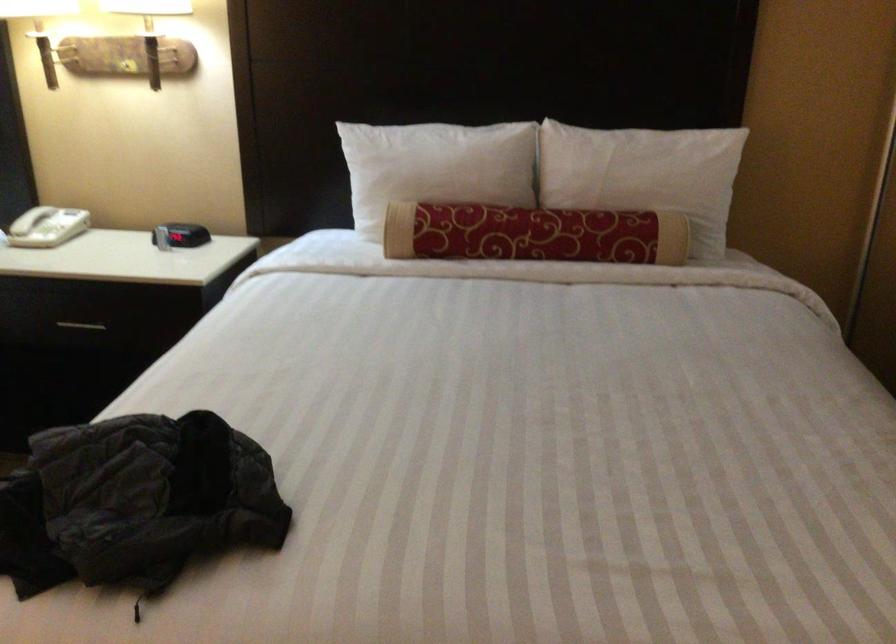
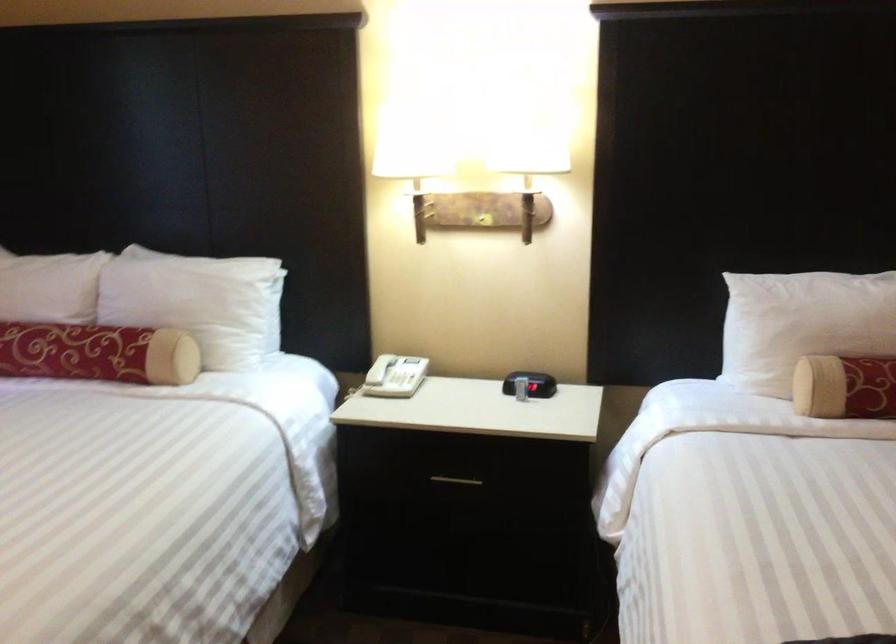
The point at (407,234) is marked in the first image. Where is the corresponding point in the second image?

(845, 386)